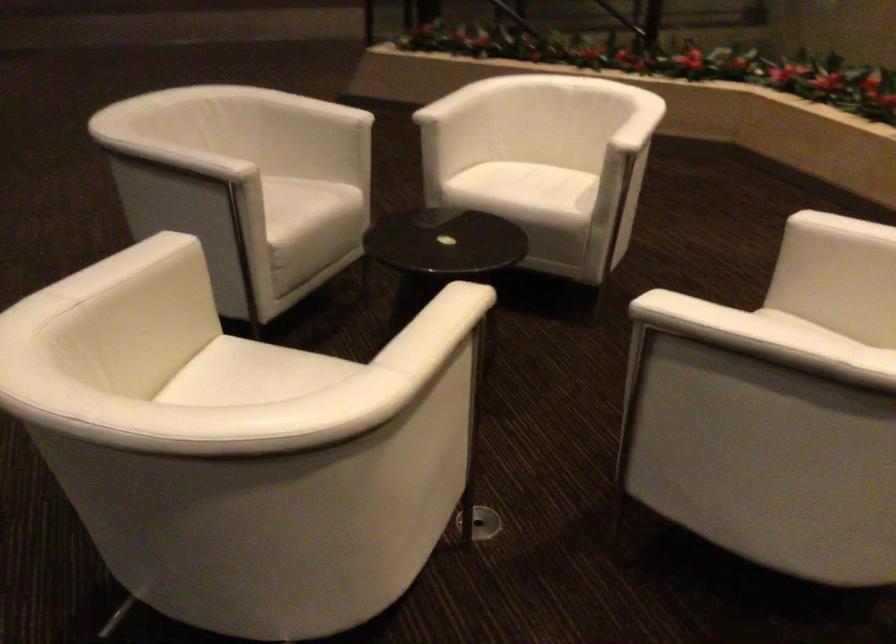
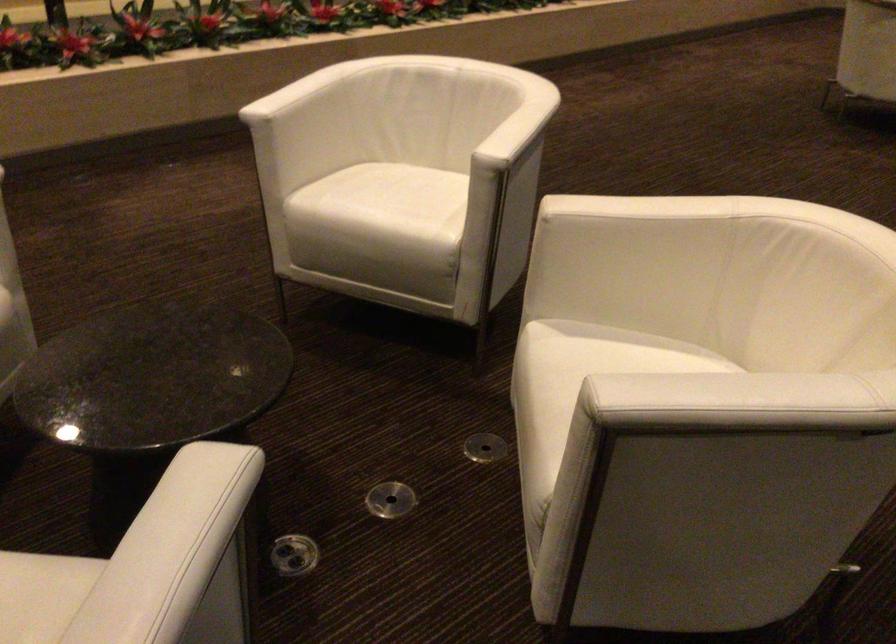
Find the pixel in the second image that matches (x=102, y=269) in the first image.

(737, 402)